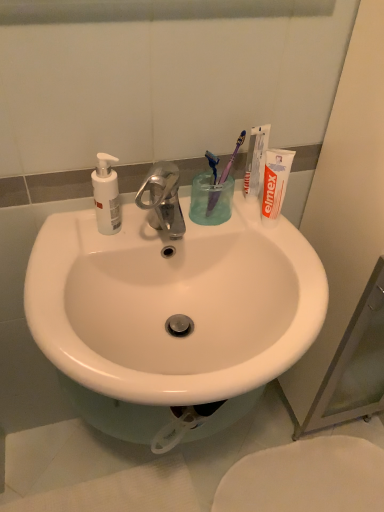
Find the location of a particular element. The image size is (384, 512). vacant space that's between white matte soap dispenser at left and white matte toothpaste tube at upper right is located at coordinates (186, 228).